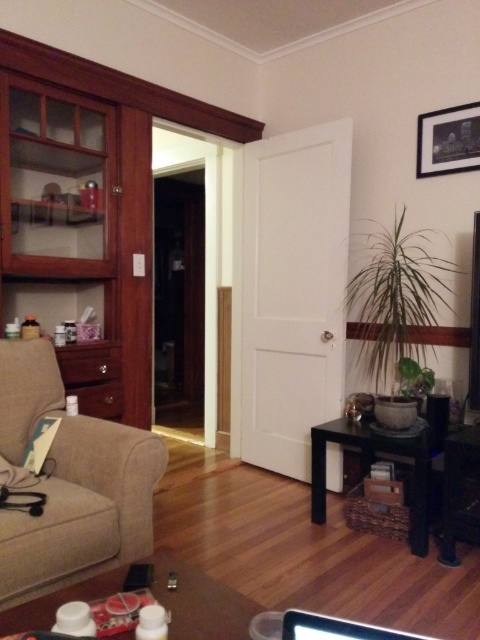
Question: Is black glossy cabinet at lower right in front of matte black picture frame at upper right?

Choices:
 (A) no
 (B) yes

Answer: (B)

Question: Which point is closer to the camera?

Choices:
 (A) matte black picture frame at upper right
 (B) beige fabric armchair at left
 (C) black glossy cabinet at lower right

Answer: (B)

Question: Among these points, which one is farthest from the camera?

Choices:
 (A) (456, 452)
 (B) (63, 566)
 (C) (466, 154)

Answer: (C)

Question: Which of the following is the closest to the observer?

Choices:
 (A) black glossy cabinet at lower right
 (B) matte black picture frame at upper right

Answer: (A)

Question: Does beige fabric armchair at left lie in front of matte black picture frame at upper right?

Choices:
 (A) yes
 (B) no

Answer: (A)

Question: Is beige fabric armchair at left positioned behind matte black picture frame at upper right?

Choices:
 (A) yes
 (B) no

Answer: (B)